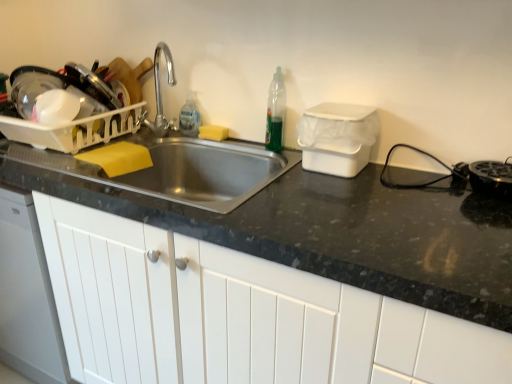
The width and height of the screenshot is (512, 384). I want to click on free area below white plastic container at upper right, arranged as the 2th appliance when viewed from the right (from a real-world perspective), so click(330, 174).